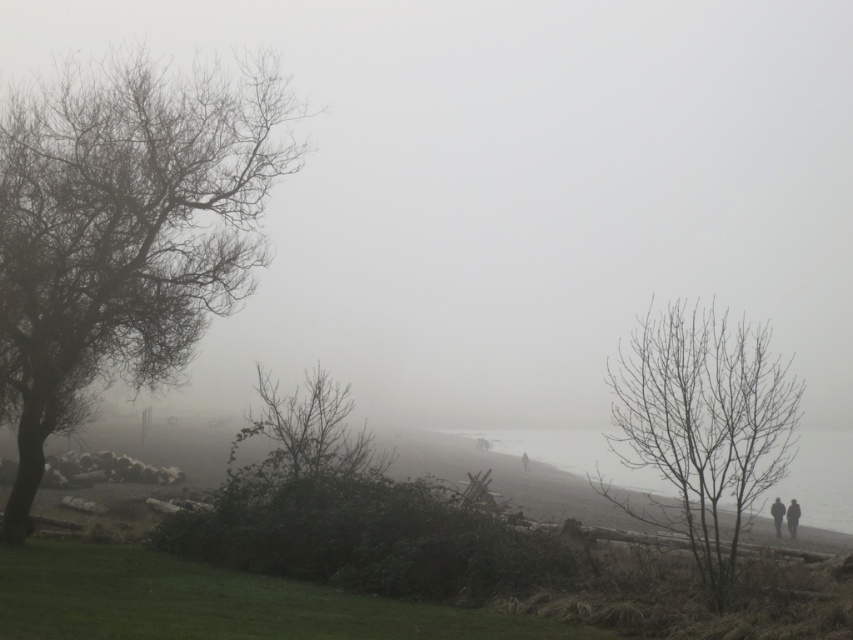
Question: Is gray foggy water at center positioned at the back of dark gray fabric jacket at lower right?

Choices:
 (A) no
 (B) yes

Answer: (A)

Question: Which object appears closest to the camera in this image?

Choices:
 (A) dark gray fabric jacket at lower right
 (B) bare branches at right
 (C) dark gray fabric person at lower right
 (D) bare branches at center

Answer: (B)

Question: Among these objects, which one is farthest from the camera?

Choices:
 (A) gray foggy water at center
 (B) bare branches at left
 (C) dark gray fabric jacket at lower right

Answer: (C)

Question: Does bare branches at center have a larger size compared to dark gray fabric jacket at lower right?

Choices:
 (A) yes
 (B) no

Answer: (A)

Question: Does bare branches at right appear on the left side of dark gray fabric jacket at lower right?

Choices:
 (A) yes
 (B) no

Answer: (A)

Question: Which object is positioned closest to the bare branches at right?

Choices:
 (A) gray foggy water at center
 (B) foggy atmosphere at center
 (C) bare branches at center

Answer: (A)